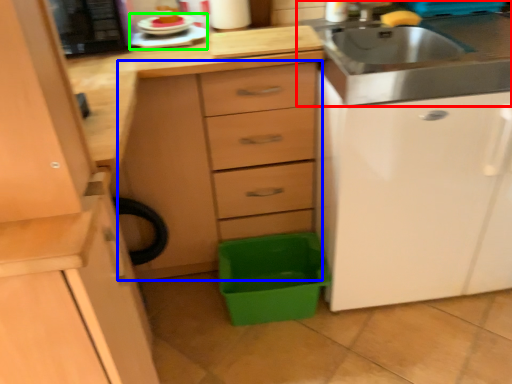
Question: Based on their relative distances, which object is nearer to sink (highlighted by a red box)? Choose from chest of drawers (highlighted by a blue box) and appliance (highlighted by a green box).

Choices:
 (A) chest of drawers
 (B) appliance

Answer: (A)